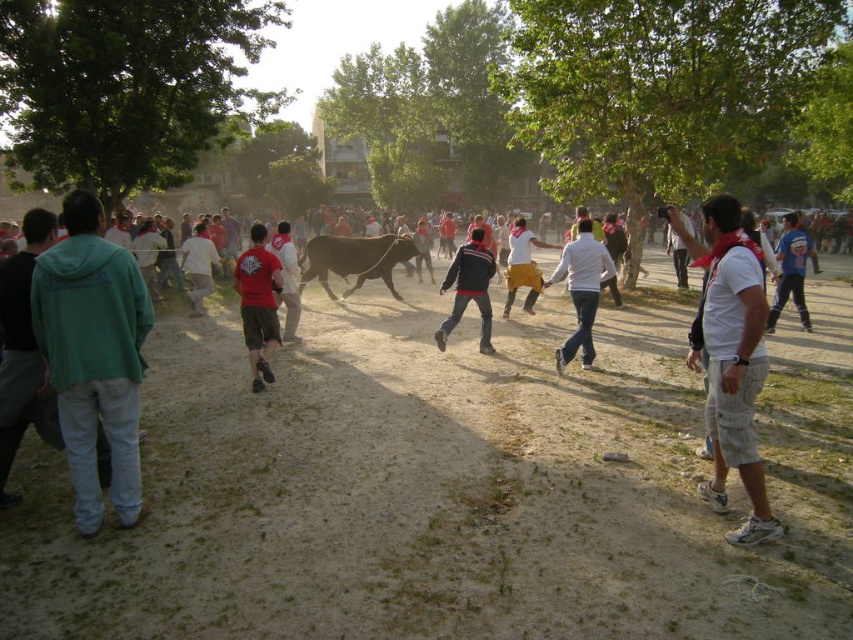
Is white cotton shirt at center to the left of yellow cotton pants at center from the viewer's perspective?

In fact, white cotton shirt at center is to the right of yellow cotton pants at center.

This screenshot has height=640, width=853. Describe the element at coordinates (732, 360) in the screenshot. I see `white cotton shirt at center` at that location.

This screenshot has width=853, height=640. I want to click on white cotton shirt at center, so click(732, 360).

You are a GUI agent. You are given a task and a screenshot of the screen. Output one action in this format:
    pyautogui.click(x=<x>, y=<y>)
    Task: Click on the white cotton shirt at center
    
    Given the screenshot: What is the action you would take?
    pyautogui.click(x=732, y=360)

What do you see at coordinates (581, 289) in the screenshot? I see `white matte jacket at center` at bounding box center [581, 289].

Does white matte jacket at center appear over dark blue jacket at center?

No, white matte jacket at center is not above dark blue jacket at center.

Between point (584, 316) and point (451, 280), which one is positioned behind?

Point (451, 280)

Identify the location of white matte jacket at center. pos(581,289).

Does matte red shirt at center appear over white matte jacket at center?

Correct, matte red shirt at center is located above white matte jacket at center.

Is point (279, 275) positioned after point (567, 272)?

No, (279, 275) is closer to viewer.

Is point (270, 344) behind point (561, 349)?

No, it is not.

Find the location of a particular element. matte red shirt at center is located at coordinates (258, 305).